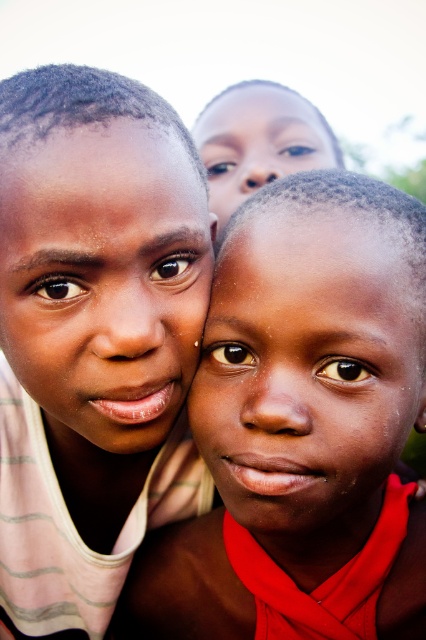
Question: From the image, what is the correct spatial relationship of smooth skin child at center in relation to matte skin face at center?

Choices:
 (A) above
 (B) below

Answer: (B)

Question: Which object is the closest to the smooth skin child at center?

Choices:
 (A) smooth skin face at upper center
 (B) smooth skin face at center

Answer: (B)

Question: Observing the image, what is the correct spatial positioning of smooth skin child at center in reference to smooth skin face at center?

Choices:
 (A) below
 (B) above

Answer: (A)

Question: Which point appears closest to the camera in this image?

Choices:
 (A) (287, 381)
 (B) (129, 349)

Answer: (B)

Question: Estimate the real-world distances between objects in this image. Which object is farther from the matte skin face at center?

Choices:
 (A) smooth skin face at center
 (B) smooth skin face at upper center
 (C) smooth skin child at center

Answer: (B)

Question: Does smooth skin child at center have a greater width compared to matte skin face at center?

Choices:
 (A) no
 (B) yes

Answer: (B)